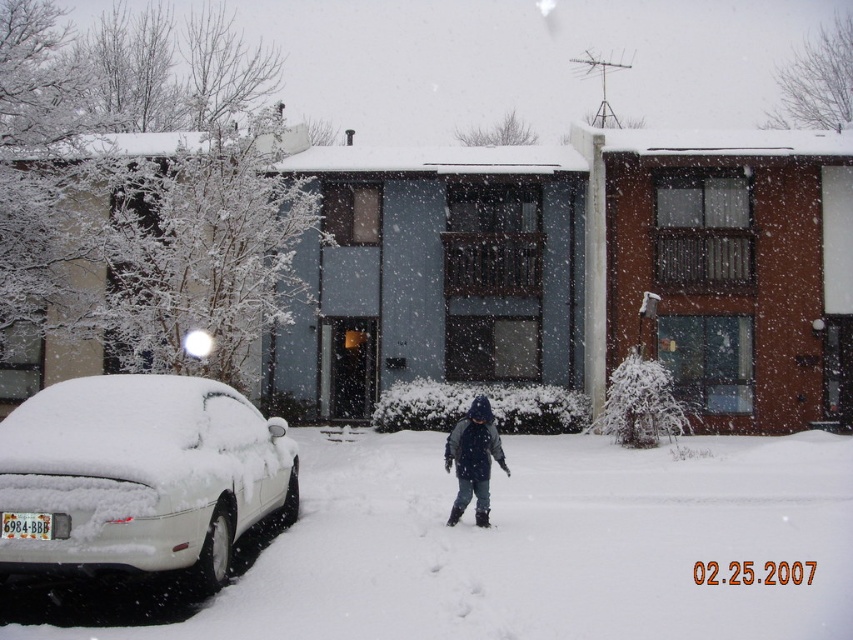
Does white matte car at left have a lesser height compared to dark blue knit hat at center?

No.

Between point (239, 458) and point (480, 516), which one is positioned behind?

The point (480, 516) is more distant.

Is point (33, 451) positioned after point (482, 410)?

That is False.

The width and height of the screenshot is (853, 640). Find the location of `white matte car at left`. white matte car at left is located at coordinates (138, 476).